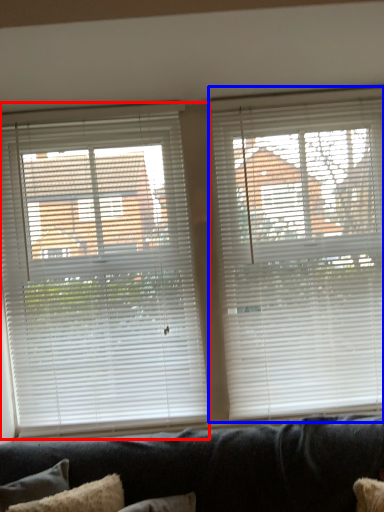
Question: Among these objects, which one is farthest to the camera, window blind (highlighted by a red box) or window blind (highlighted by a blue box)?

Choices:
 (A) window blind
 (B) window blind

Answer: (A)